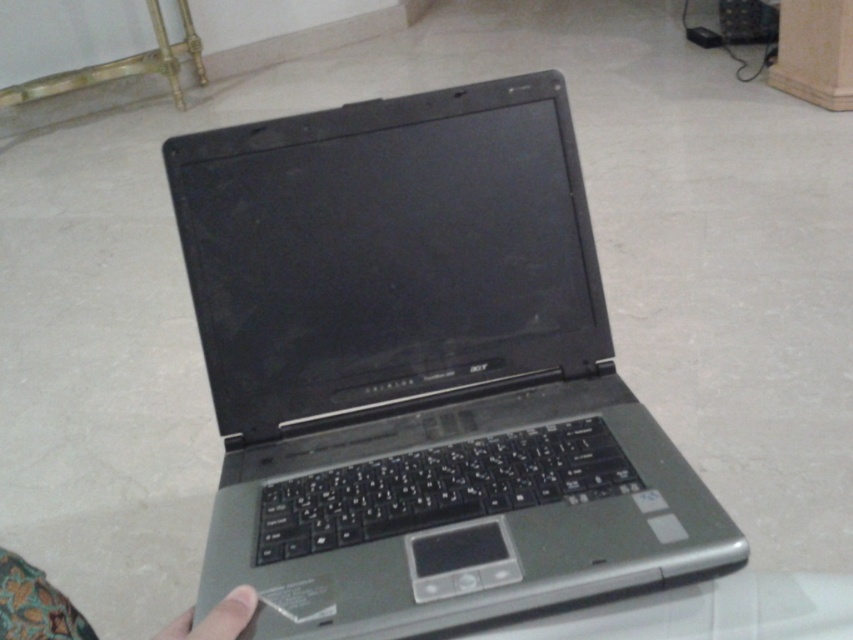
You are a photographer setting up a still life shot. You have a satin silver laptop at center and a skinny finger at lower left in your frame. Based on the scene, which object occupies more space in the image?

The satin silver laptop at center is larger in size than the skinny finger at lower left, so it occupies more space in the image.